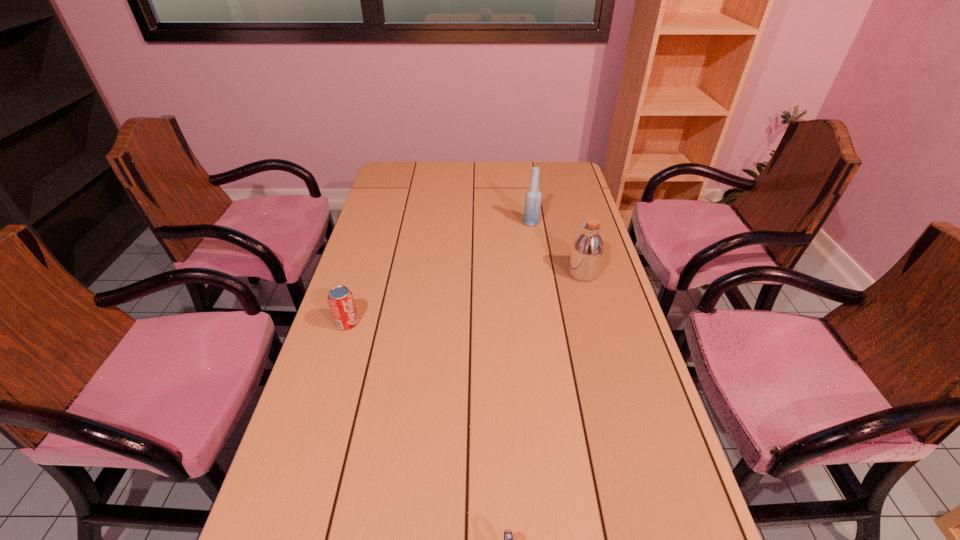
You are a GUI agent. You are given a task and a screenshot of the screen. Output one action in this format:
    pyautogui.click(x=<x>, y=<y>)
    Task: Click on the left bottle
    The image size is (960, 540).
    Given the screenshot: What is the action you would take?
    pyautogui.click(x=532, y=208)

Find the location of `the farther bottle`. the farther bottle is located at coordinates (532, 208).

At what (x,y) coordinates should I click in order to perform the action: click on the third nearest object. Please return your answer as a coordinate pair (x, y). The image size is (960, 540). Looking at the image, I should click on (587, 249).

Where is `the rightmost object`? the rightmost object is located at coordinates (587, 249).

This screenshot has height=540, width=960. What are the coordinates of `the third farthest object` in the screenshot? It's located at (340, 299).

Locate an element on the screen. The width and height of the screenshot is (960, 540). soda can is located at coordinates (340, 299).

Identify the location of vacant area located on the left of the third object from left to right. This screenshot has height=540, width=960. (493, 223).

At what (x,y) coordinates should I click in order to perform the action: click on free space located 0.300m on the front of the second farthest object. Please return your answer as a coordinate pair (x, y). Image resolution: width=960 pixels, height=540 pixels. Looking at the image, I should click on (607, 361).

You are a GUI agent. You are given a task and a screenshot of the screen. Output one action in this format:
    pyautogui.click(x=<x>, y=<y>)
    Task: Click on the free space located on the back of the leftmost object
    This screenshot has width=960, height=540.
    Given the screenshot: What is the action you would take?
    pyautogui.click(x=361, y=278)

Identify the location of object at the left edge. (340, 299).